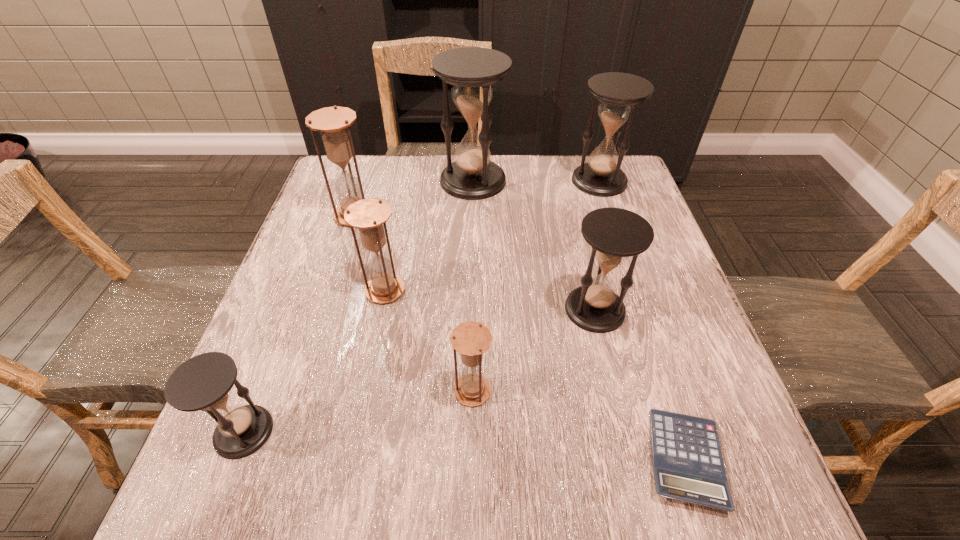
This screenshot has height=540, width=960. Identify the location of the tallest object. (471, 70).

Image resolution: width=960 pixels, height=540 pixels. Find the location of `the tallest hourglass`. the tallest hourglass is located at coordinates (471, 70).

The width and height of the screenshot is (960, 540). What are the coordinates of `the second biggest black hourglass` in the screenshot? It's located at (619, 94).

Locate an element on the screen. This screenshot has height=540, width=960. the sixth nearest object is located at coordinates (333, 123).

The height and width of the screenshot is (540, 960). Find the location of `the biggest brown hourglass`. the biggest brown hourglass is located at coordinates (333, 123).

I want to click on the third biggest black hourglass, so click(x=615, y=234).

Identify the location of the fifth hourglass from right to left. (369, 215).

The width and height of the screenshot is (960, 540). I want to click on the third object from left to right, so click(369, 215).

What are the coordinates of `the nearest brown hourglass` in the screenshot? It's located at (471, 339).

This screenshot has width=960, height=540. Identify the location of the rightmost brown hourglass. (471, 339).